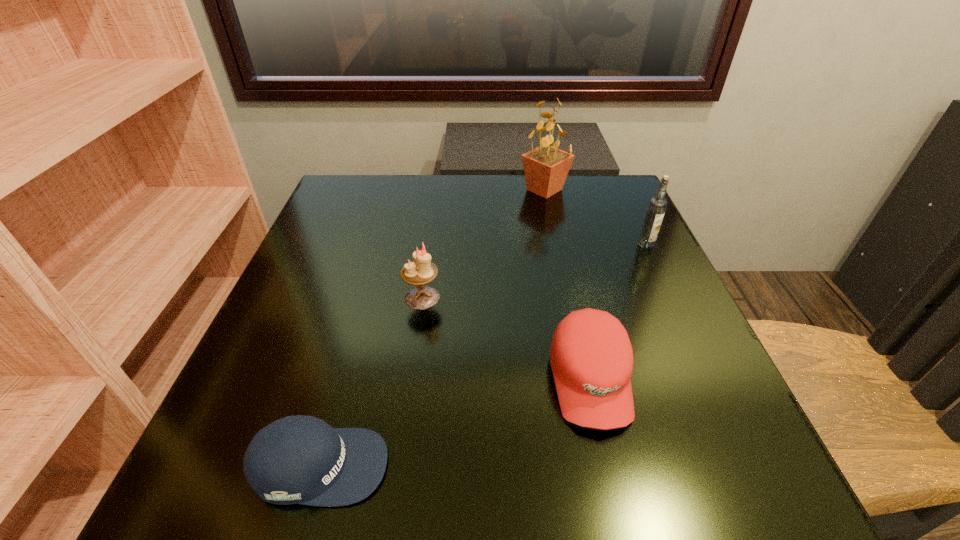
Where is `blank space located 0.300m at the front of the farthest object with flowers visible`? Image resolution: width=960 pixels, height=540 pixels. blank space located 0.300m at the front of the farthest object with flowers visible is located at coordinates (405, 190).

Locate an element on the screen. This screenshot has width=960, height=540. free space located 0.300m on the label of the vodka is located at coordinates click(x=700, y=358).

Where is `free location located 0.160m on the back of the third shortest object`? This screenshot has width=960, height=540. free location located 0.160m on the back of the third shortest object is located at coordinates (431, 239).

The height and width of the screenshot is (540, 960). I want to click on blank space located 0.360m on the front-facing side of the baseball cap, so click(x=652, y=465).

Where is `object at the far edge`? The image size is (960, 540). object at the far edge is located at coordinates (546, 167).

Where is `object that is at the near edge`? The height and width of the screenshot is (540, 960). object that is at the near edge is located at coordinates (298, 459).

Identify the location of object that is at the left edge. This screenshot has width=960, height=540. (298, 459).

Identify the location of sunflower present at the right edge. (546, 167).

The image size is (960, 540). In order to click on vodka located in the right edge section of the desktop in this screenshot , I will do `click(657, 205)`.

Where is `cap that is at the right edge`? The height and width of the screenshot is (540, 960). cap that is at the right edge is located at coordinates (591, 357).